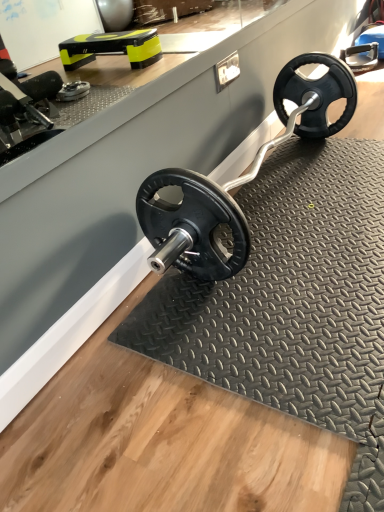
Question: Does black rubber mat at center have a lesser width compared to black rubber weight plate at center?

Choices:
 (A) no
 (B) yes

Answer: (A)

Question: Can you confirm if black rubber mat at center is positioned to the right of black rubber weight plate at center?

Choices:
 (A) yes
 (B) no

Answer: (A)

Question: From the image's perspective, is black rubber mat at center over black rubber weight plate at center?

Choices:
 (A) yes
 (B) no

Answer: (B)

Question: Does black rubber mat at center come in front of black rubber weight plate at center?

Choices:
 (A) no
 (B) yes

Answer: (B)

Question: From the image's perspective, is black rubber mat at center beneath black rubber weight plate at center?

Choices:
 (A) yes
 (B) no

Answer: (A)

Question: Does black rubber mat at center have a greater width compared to black rubber weight plate at center?

Choices:
 (A) no
 (B) yes

Answer: (B)

Question: Is black rubber weight plate at center taller than black rubber mat at center?

Choices:
 (A) no
 (B) yes

Answer: (B)

Question: Does black rubber weight plate at center lie in front of black rubber mat at center?

Choices:
 (A) no
 (B) yes

Answer: (A)

Question: Is black rubber weight plate at center shorter than black rubber mat at center?

Choices:
 (A) yes
 (B) no

Answer: (B)

Question: Does black rubber weight plate at center have a larger size compared to black rubber mat at center?

Choices:
 (A) no
 (B) yes

Answer: (B)

Question: Does black rubber weight plate at center come behind black rubber mat at center?

Choices:
 (A) no
 (B) yes

Answer: (B)

Question: Is black rubber weight plate at center smaller than black rubber mat at center?

Choices:
 (A) no
 (B) yes

Answer: (A)

Question: Is point (322, 54) positioned closer to the camera than point (357, 320)?

Choices:
 (A) farther
 (B) closer

Answer: (A)